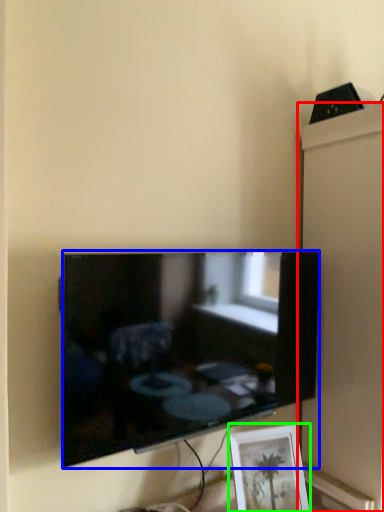
Question: Estimate the real-world distances between objects in this image. Which object is farther from cabinet (highlighted by a red box), television (highlighted by a blue box) or picture frame (highlighted by a green box)?

Choices:
 (A) television
 (B) picture frame

Answer: (B)